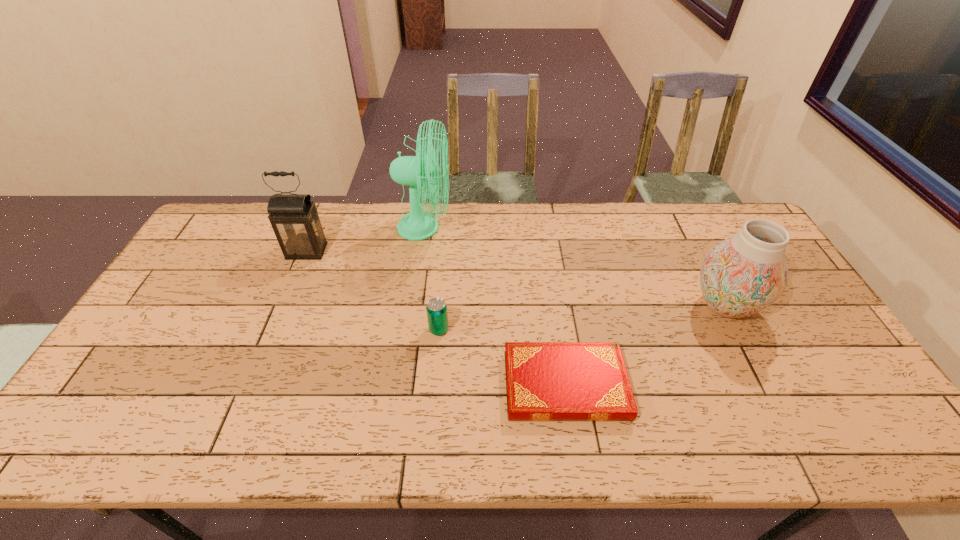
In order to click on fan in this screenshot , I will do `click(422, 171)`.

What are the coordinates of `lantern` in the screenshot? It's located at (294, 218).

You are a GUI agent. You are given a task and a screenshot of the screen. Output one action in this format:
    pyautogui.click(x=<x>, y=<y>)
    Task: Click on the rightmost object
    This screenshot has height=540, width=960.
    Given the screenshot: What is the action you would take?
    pyautogui.click(x=740, y=276)

Where is `the fourth tallest object`? The height and width of the screenshot is (540, 960). the fourth tallest object is located at coordinates (437, 316).

What are the coordinates of `the shortest object` in the screenshot? It's located at (545, 381).

Identify the location of the second object from right to left. This screenshot has height=540, width=960. (545, 381).

Locate an element on the screen. The height and width of the screenshot is (540, 960). free point located 0.090m in front of the fan to blow air is located at coordinates (477, 228).

Where is `vacant position located 0.060m on the front-facing side of the leftmost object`? The width and height of the screenshot is (960, 540). vacant position located 0.060m on the front-facing side of the leftmost object is located at coordinates (297, 275).

Find the location of a particular element. vacant position located 0.300m on the back of the rightmost object is located at coordinates pos(681,220).

At what (x,y) coordinates should I click in order to perform the action: click on blank space located 0.400m on the back of the beer can. Please return your answer as a coordinate pair (x, y). The image size is (960, 540). Looking at the image, I should click on (447, 232).